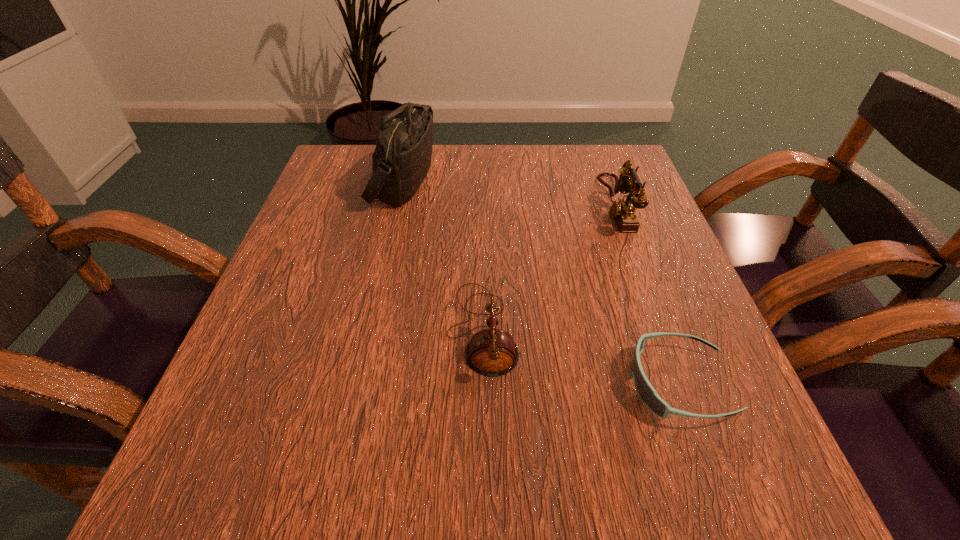
Locate an element on the screen. The width and height of the screenshot is (960, 540). object identified as the second closest to the shortest object is located at coordinates (622, 211).